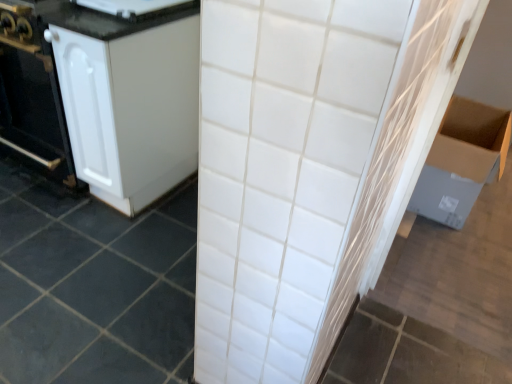
Describe the element at coordinates (129, 99) in the screenshot. I see `white matte cabinet at left` at that location.

Describe the element at coordinates (137, 7) in the screenshot. I see `white glossy refrigerator at upper left` at that location.

Where is `white matte cabinet at left`? The height and width of the screenshot is (384, 512). white matte cabinet at left is located at coordinates (129, 99).

Is white ceramic tile at center located outside white matte cabinet at left?

Yes, white ceramic tile at center is outside of white matte cabinet at left.

Is point (85, 231) positioned behind point (160, 44)?

Yes, point (85, 231) is farther from viewer.

Is white ceramic tile at center directly adjacent to white matte cabinet at left?

No, white ceramic tile at center is not next to white matte cabinet at left.

Is white ceramic tile at center bigger than white matte cabinet at left?

Incorrect, white ceramic tile at center is not larger than white matte cabinet at left.

Is the depth of white glossy refrigerator at upper left greater than that of cardboard box at right?

That is False.

From a real-world perspective, which object stands above the other?

white glossy refrigerator at upper left, from a real-world perspective.

Does white glossy refrigerator at upper left touch cardboard box at right?

They are not placed beside each other.

Who is taller, white glossy refrigerator at upper left or cardboard box at right?

cardboard box at right is taller.

This screenshot has width=512, height=384. I want to click on ceramic tile on the left of white matte cabinet at left, so click(x=93, y=288).

Is white matte cabinet at left not inside white ceramic tile at center?

Yes.

Who is smaller, white matte cabinet at left or white ceramic tile at center?

white ceramic tile at center is smaller.

Is white matte cabinet at left far away from white ceramic tile at center?

No, white matte cabinet at left is not far away from white ceramic tile at center.

Does cardboard box at right come in front of white ceramic tile at center?

No, it is behind white ceramic tile at center.

Considering the positions of objects cardboard box at right and white ceramic tile at center in the image provided, who is more to the right, cardboard box at right or white ceramic tile at center?

cardboard box at right.

Would you consider cardboard box at right to be distant from white ceramic tile at center?

Yes, cardboard box at right is far from white ceramic tile at center.

Is white ceramic tile at center positioned far away from cardboard box at right?

white ceramic tile at center is far away from cardboard box at right.

Image resolution: width=512 pixels, height=384 pixels. I want to click on ceramic tile that appears on the left of cardboard box at right, so click(93, 288).

Which object is positioned more to the right, white ceramic tile at center or cardboard box at right?

Positioned to the right is cardboard box at right.

Between white ceramic tile at center and cardboard box at right, which one has larger width?

white ceramic tile at center.

Could you tell me if white matte cabinet at left is turned towards white glossy refrigerator at upper left?

No, white matte cabinet at left is not facing towards white glossy refrigerator at upper left.

Who is taller, white matte cabinet at left or white glossy refrigerator at upper left?

white matte cabinet at left is taller.

Between white matte cabinet at left and white glossy refrigerator at upper left, which one has larger size?

white matte cabinet at left.

From a real-world perspective, is white matte cabinet at left over white glossy refrigerator at upper left?

Incorrect, from a real-world perspective, white matte cabinet at left is lower than white glossy refrigerator at upper left.

From the image's perspective, which one is positioned lower, white glossy refrigerator at upper left or white matte cabinet at left?

From the image's view, white matte cabinet at left is below.

Is white matte cabinet at left at the back of white glossy refrigerator at upper left?

No, white glossy refrigerator at upper left's orientation is not away from white matte cabinet at left.

Which of these two, white glossy refrigerator at upper left or white matte cabinet at left, stands shorter?

white glossy refrigerator at upper left.

I want to click on ceramic tile below the white matte cabinet at left (from a real-world perspective), so click(x=93, y=288).

Where is `cardboard box below the white glossy refrigerator at upper left (from the image's perspective)`? The image size is (512, 384). cardboard box below the white glossy refrigerator at upper left (from the image's perspective) is located at coordinates [x=461, y=161].

Based on their spatial positions, is white ceramic tile at center or cardboard box at right closer to white glossy refrigerator at upper left?

The object closer to white glossy refrigerator at upper left is white ceramic tile at center.

Considering their positions, is cardboard box at right positioned closer to white glossy refrigerator at upper left than white ceramic tile at center?

Among the two, white ceramic tile at center is located nearer to white glossy refrigerator at upper left.

From the image, which object appears to be nearer to white matte cabinet at left, cardboard box at right or white glossy refrigerator at upper left?

white glossy refrigerator at upper left is closer to white matte cabinet at left.

When comparing their distances from white matte cabinet at left, does white glossy refrigerator at upper left or white ceramic tile at center seem closer?

white glossy refrigerator at upper left is closer to white matte cabinet at left.

Based on their spatial positions, is white ceramic tile at center or white glossy refrigerator at upper left further from white matte cabinet at left?

Among the two, white ceramic tile at center is located further to white matte cabinet at left.

From the image, which object appears to be farther from white matte cabinet at left, cardboard box at right or white ceramic tile at center?

Based on the image, cardboard box at right appears to be further to white matte cabinet at left.

Estimate the real-world distances between objects in this image. Which object is further from white ceramic tile at center, white matte cabinet at left or cardboard box at right?

cardboard box at right is positioned further to the anchor white ceramic tile at center.

When comparing their distances from cardboard box at right, does white matte cabinet at left or white glossy refrigerator at upper left seem closer?

The object closer to cardboard box at right is white matte cabinet at left.

The width and height of the screenshot is (512, 384). Find the location of `appliance located between white matte cabinet at left and cardboard box at right in the left-right direction`. appliance located between white matte cabinet at left and cardboard box at right in the left-right direction is located at coordinates point(137,7).

Find the location of a particular element. cabinetry between white glossy refrigerator at upper left and white ceramic tile at center in the up-down direction is located at coordinates (129, 99).

The height and width of the screenshot is (384, 512). Identify the location of appliance situated between white ceramic tile at center and cardboard box at right from left to right. (137, 7).

Find the location of a particular element. cabinetry located between white ceramic tile at center and cardboard box at right in the left-right direction is located at coordinates (129, 99).